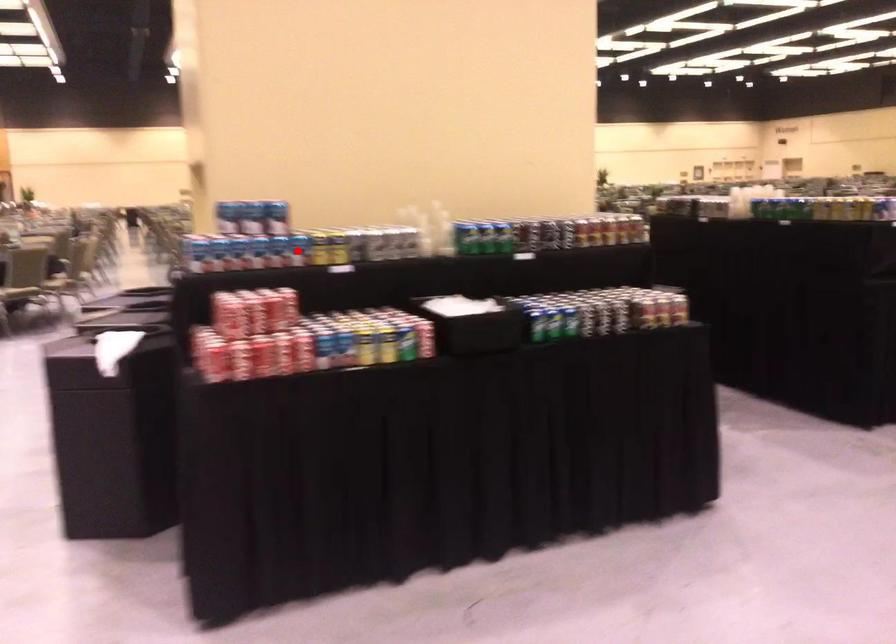
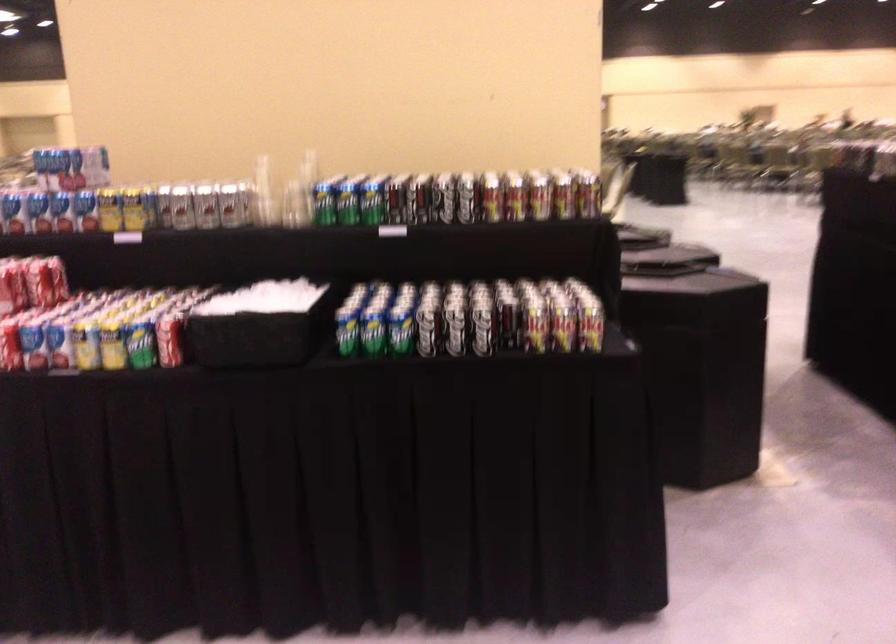
Question: I am providing you with two images of the same scene from different viewpoints. A red point is shown in image1. For the corresponding object point in image2, is it positioned nearer or farther from the camera?

Choices:
 (A) Nearer
 (B) Farther

Answer: (A)